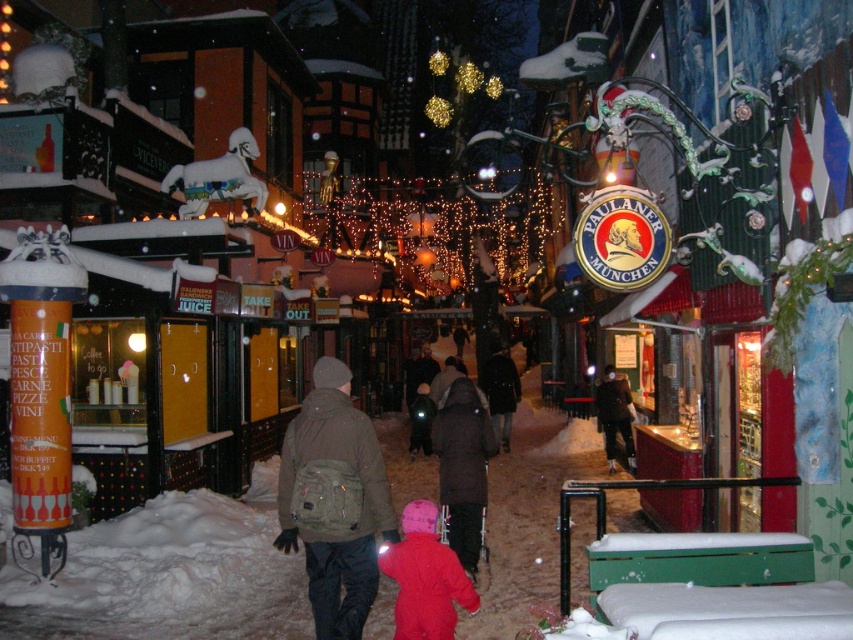
Question: Which point is farther to the camera?

Choices:
 (A) matte pink snowsuit at lower center
 (B) dark brown coat at center

Answer: (B)

Question: Is matte pink snowsuit at lower center to the left of dark brown coat at center from the viewer's perspective?

Choices:
 (A) no
 (B) yes

Answer: (B)

Question: Is olive green backpack at center to the left of matte pink snowsuit at lower center from the viewer's perspective?

Choices:
 (A) yes
 (B) no

Answer: (A)

Question: Where is matte pink snowsuit at lower center located in relation to dark brown coat at center in the image?

Choices:
 (A) right
 (B) left

Answer: (B)

Question: Which of the following is the farthest from the observer?

Choices:
 (A) (392, 563)
 (B) (450, 403)

Answer: (B)

Question: Among these points, which one is farthest from the camera?

Choices:
 (A) (378, 509)
 (B) (457, 529)

Answer: (B)